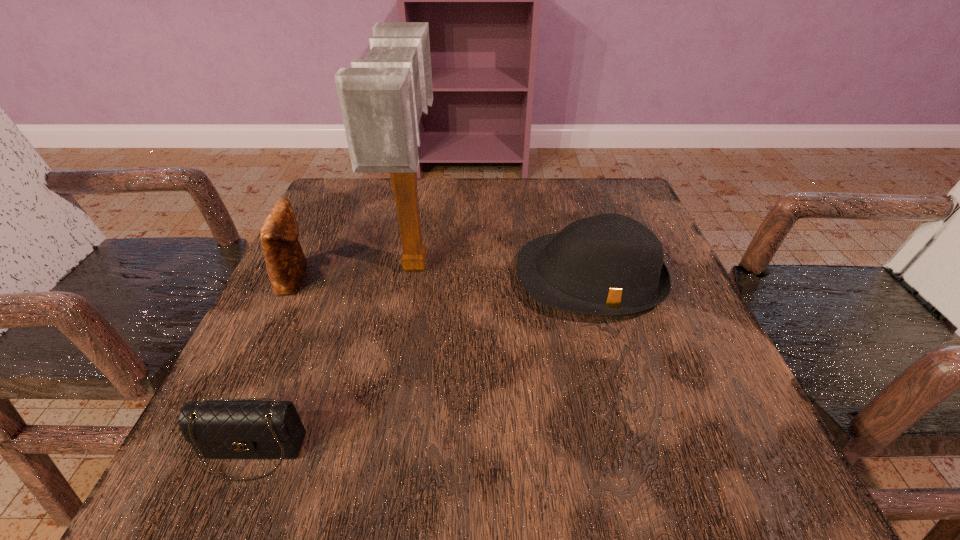
Where is `object that is positioned at the far edge`? This screenshot has width=960, height=540. object that is positioned at the far edge is located at coordinates (382, 97).

Locate an element on the screen. The height and width of the screenshot is (540, 960). object that is at the near edge is located at coordinates (242, 428).

You are a GUI agent. You are given a task and a screenshot of the screen. Output one action in this format:
    pyautogui.click(x=<x>, y=<y>)
    Task: Click on the object present at the right edge
    
    Given the screenshot: What is the action you would take?
    pyautogui.click(x=609, y=264)

Where is `object that is at the near left corner`? This screenshot has width=960, height=540. object that is at the near left corner is located at coordinates (242, 428).

In the image, there is a desktop. Identify the location of vacant space at the far edge. (479, 198).

This screenshot has width=960, height=540. In order to click on vacant region at the left edge in this screenshot , I will do `click(342, 239)`.

Locate an element on the screen. This screenshot has width=960, height=540. vacant space at the right edge is located at coordinates (682, 321).

This screenshot has width=960, height=540. What are the coordinates of `vacant area at the far left corner` in the screenshot? It's located at (387, 199).

Image resolution: width=960 pixels, height=540 pixels. Find the location of `vacant space at the far right corner`. vacant space at the far right corner is located at coordinates click(615, 203).

Where is `free space at the near right corner of the desktop`? free space at the near right corner of the desktop is located at coordinates pyautogui.click(x=704, y=437).